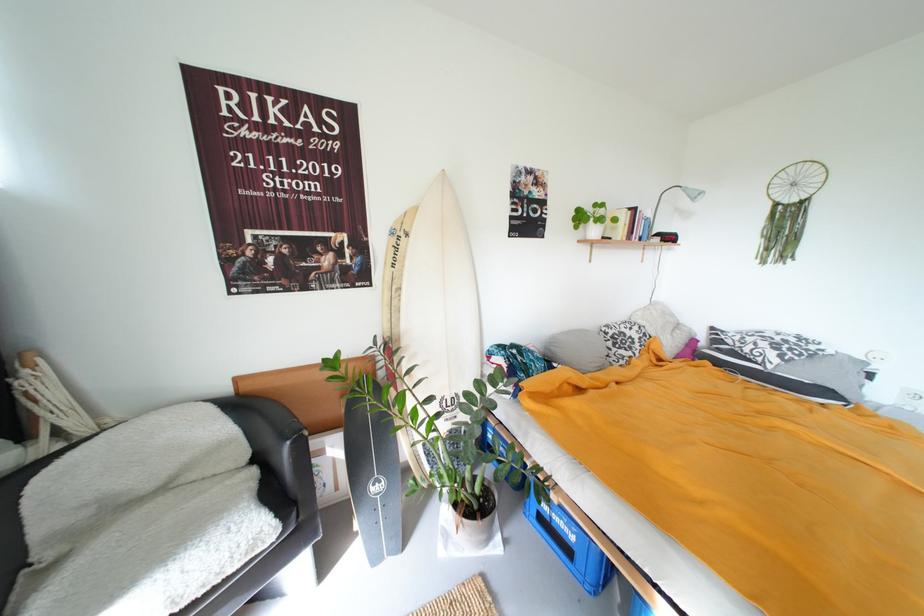
Which object does [624,336] point to?

This point indicates the patterned pillow.